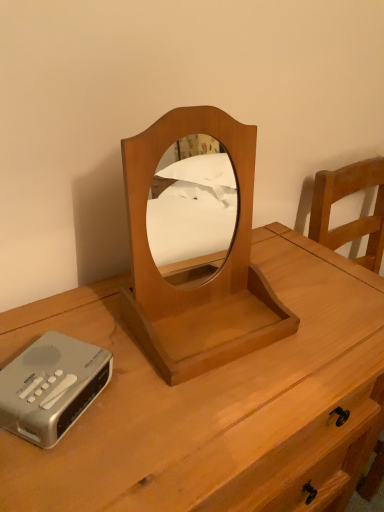
Find the location of `vacant space to the right of silver metallic cassette at lower left`. vacant space to the right of silver metallic cassette at lower left is located at coordinates (163, 411).